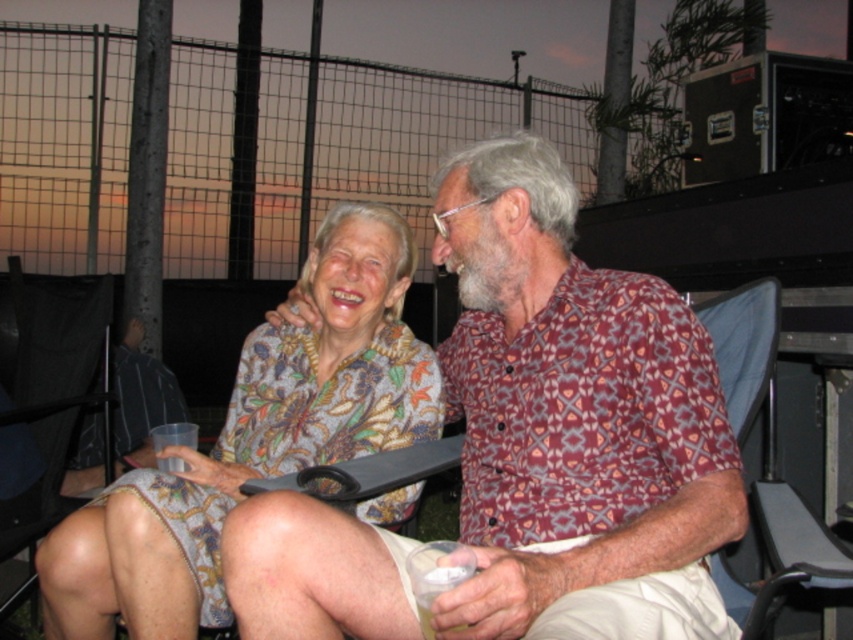
Question: Is floral-patterned dress at center to the right of black mesh chair at lower left from the viewer's perspective?

Choices:
 (A) yes
 (B) no

Answer: (A)

Question: Does floral-patterned dress at center appear over black mesh chair at lower left?

Choices:
 (A) yes
 (B) no

Answer: (A)

Question: Which point is closer to the camera?

Choices:
 (A) (39, 280)
 (B) (763, 362)
 (C) (222, 477)

Answer: (B)

Question: Which point is farther to the camera?

Choices:
 (A) (134, 605)
 (B) (694, 435)
 (C) (55, 493)

Answer: (C)

Question: Is floral-patterned dress at center smaller than black mesh chair at lower left?

Choices:
 (A) yes
 (B) no

Answer: (A)

Question: Which point is closer to the camera taking this photo?

Choices:
 (A) (474, 582)
 (B) (39, 486)
 (C) (140, 445)

Answer: (A)